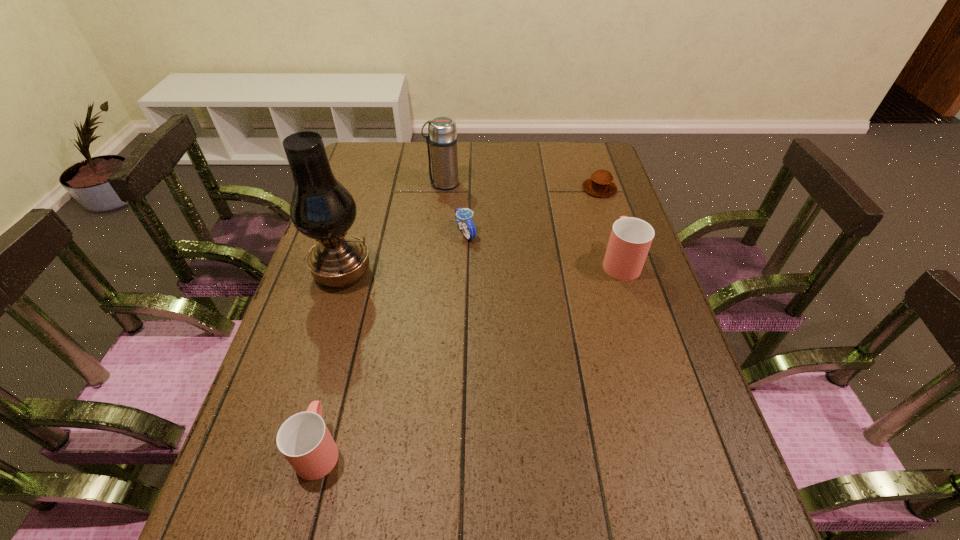
This screenshot has width=960, height=540. In order to click on object situated at the far edge in this screenshot , I will do `click(442, 137)`.

Image resolution: width=960 pixels, height=540 pixels. Find the location of `object present at the near edge`. object present at the near edge is located at coordinates tap(304, 439).

Locate an element on the screen. Image resolution: width=960 pixels, height=540 pixels. cup at the left edge is located at coordinates (304, 439).

You are a GUI agent. You are given a task and a screenshot of the screen. Output one action in this format:
    pyautogui.click(x=<x>, y=<y>)
    Task: Click on the oil lamp situated at the left edge
    Image resolution: width=960 pixels, height=540 pixels.
    Given the screenshot: What is the action you would take?
    pyautogui.click(x=321, y=208)

You are a GUI agent. You are given a task and a screenshot of the screen. Output one action in this format:
    pyautogui.click(x=<x>, y=<y>)
    Task: Click on the cup at the right edge
    This screenshot has width=960, height=540.
    Given the screenshot: What is the action you would take?
    pyautogui.click(x=630, y=240)

The width and height of the screenshot is (960, 540). Find the location of `muffin located in the right edge section of the desktop`. muffin located in the right edge section of the desktop is located at coordinates (600, 184).

Identify the location of object located in the near left corner section of the desktop. Image resolution: width=960 pixels, height=540 pixels. (304, 439).

You are a GUI agent. You are given a task and a screenshot of the screen. Output one action in this format:
    pyautogui.click(x=<x>, y=<y>)
    Task: Click on the blank space at the far edge of the desktop
    This screenshot has width=960, height=540.
    Given the screenshot: What is the action you would take?
    pyautogui.click(x=534, y=141)

The height and width of the screenshot is (540, 960). In order to click on vacant space at the near edge in this screenshot , I will do `click(528, 459)`.

In the image, there is a desktop. Identify the location of vacant space at the left edge. The width and height of the screenshot is (960, 540). (348, 183).